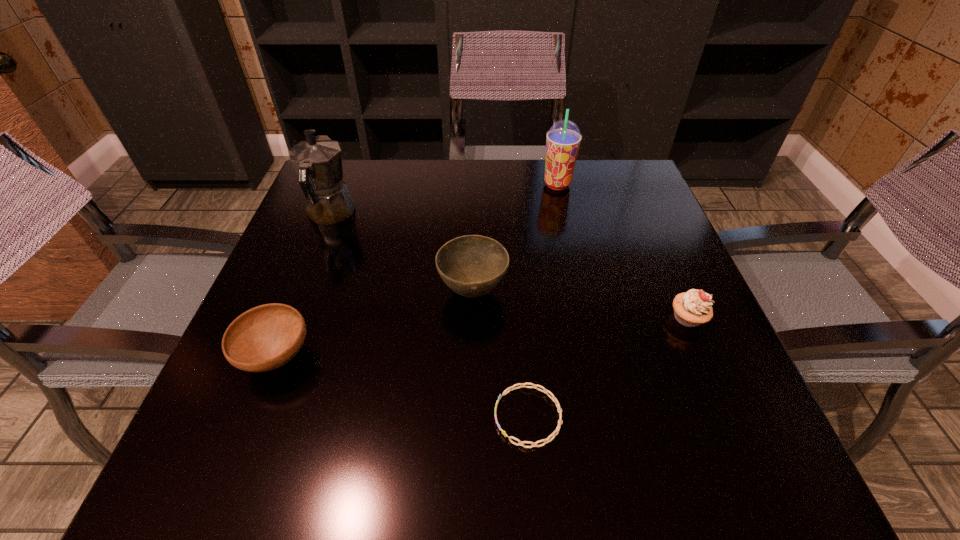
You are a GUI agent. You are given a task and a screenshot of the screen. Output one action in this format:
    pyautogui.click(x=<x>, y=<y>)
    Task: Click on the coffeepot
    
    Given the screenshot: What is the action you would take?
    pyautogui.click(x=317, y=161)

In order to click on smoothie in this screenshot , I will do `click(563, 139)`.

The width and height of the screenshot is (960, 540). In order to click on the taller bowl in this screenshot , I will do (472, 265).

Find the location of a particular element. This screenshot has width=960, height=540. the farther bowl is located at coordinates (472, 265).

Find the location of a particular element. the rightmost object is located at coordinates (694, 307).

Locate an element on the screen. The image size is (960, 540). the nearer bowl is located at coordinates (266, 337).

You are a GUI agent. You are given a task and a screenshot of the screen. Output one action in this format:
    pyautogui.click(x=<x>, y=<y>)
    Task: Click on the shorter bowl
    The image size is (960, 540).
    Given the screenshot: What is the action you would take?
    (x=266, y=337)

Identify the location of the shortest object. (511, 388).

Identify the location of free space located 0.060m on the pouring side of the coffeepot. (344, 180).

Find the location of `vacant area situated on the pouring side of the coffeepot`. vacant area situated on the pouring side of the coffeepot is located at coordinates (349, 166).